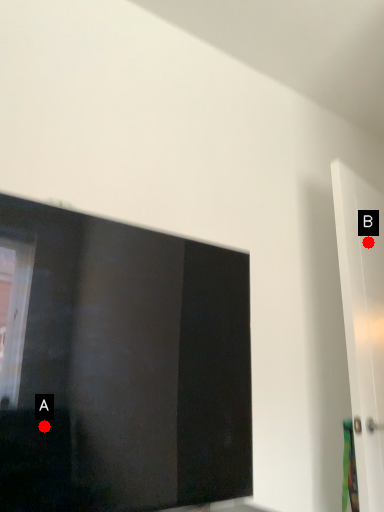
Question: Two points are circled on the image, labeled by A and B beside each circle. Which point is further to the camera?

Choices:
 (A) A is further
 (B) B is further

Answer: (B)